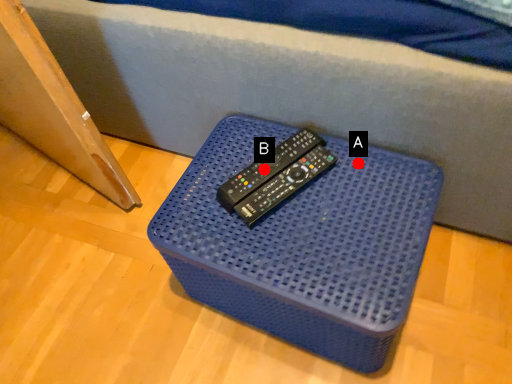
Question: Two points are circled on the image, labeled by A and B beside each circle. Which point is closer to the camera?

Choices:
 (A) A is closer
 (B) B is closer

Answer: (B)